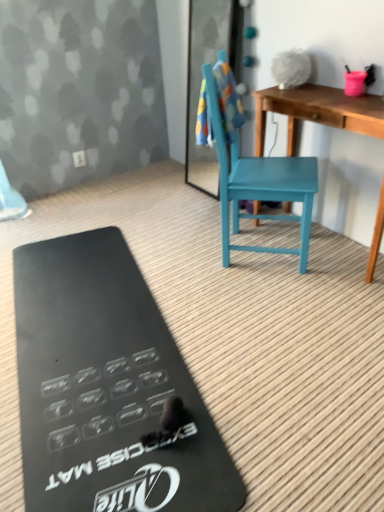
Question: Is multicolored fabric towel at upper center at the back of teal wood chair at center?

Choices:
 (A) no
 (B) yes

Answer: (B)

Question: Can you confirm if teal wood chair at center is shorter than multicolored fabric towel at upper center?

Choices:
 (A) yes
 (B) no

Answer: (B)

Question: Is teal wood chair at center taller than multicolored fabric towel at upper center?

Choices:
 (A) yes
 (B) no

Answer: (A)

Question: Can you confirm if teal wood chair at center is positioned to the right of multicolored fabric towel at upper center?

Choices:
 (A) yes
 (B) no

Answer: (A)

Question: Can you confirm if teal wood chair at center is thinner than multicolored fabric towel at upper center?

Choices:
 (A) no
 (B) yes

Answer: (A)

Question: Is black rubber exercise mat at lower left bigger or smaller than multicolored fabric towel at upper center?

Choices:
 (A) small
 (B) big

Answer: (B)

Question: In terms of width, does black rubber exercise mat at lower left look wider or thinner when compared to multicolored fabric towel at upper center?

Choices:
 (A) wide
 (B) thin

Answer: (A)

Question: Is black rubber exercise mat at lower left in front of or behind multicolored fabric towel at upper center in the image?

Choices:
 (A) behind
 (B) front

Answer: (B)

Question: From the image's perspective, is black rubber exercise mat at lower left above or below multicolored fabric towel at upper center?

Choices:
 (A) above
 (B) below

Answer: (B)

Question: From their relative heights in the image, would you say wooden desk at center is taller or shorter than teal wood chair at center?

Choices:
 (A) short
 (B) tall

Answer: (A)

Question: In the image, is wooden desk at center on the left side or the right side of teal wood chair at center?

Choices:
 (A) left
 (B) right

Answer: (B)

Question: Relative to teal wood chair at center, is wooden desk at center in front or behind?

Choices:
 (A) front
 (B) behind

Answer: (B)

Question: Considering the positions of point (311, 110) and point (301, 238), is point (311, 110) closer or farther from the camera than point (301, 238)?

Choices:
 (A) farther
 (B) closer

Answer: (B)

Question: Is white plastic power outlet at upper center inside the boundaries of teal wood chair at center, or outside?

Choices:
 (A) outside
 (B) inside

Answer: (A)

Question: From a real-world perspective, is white plastic power outlet at upper center physically located above or below teal wood chair at center?

Choices:
 (A) above
 (B) below

Answer: (B)